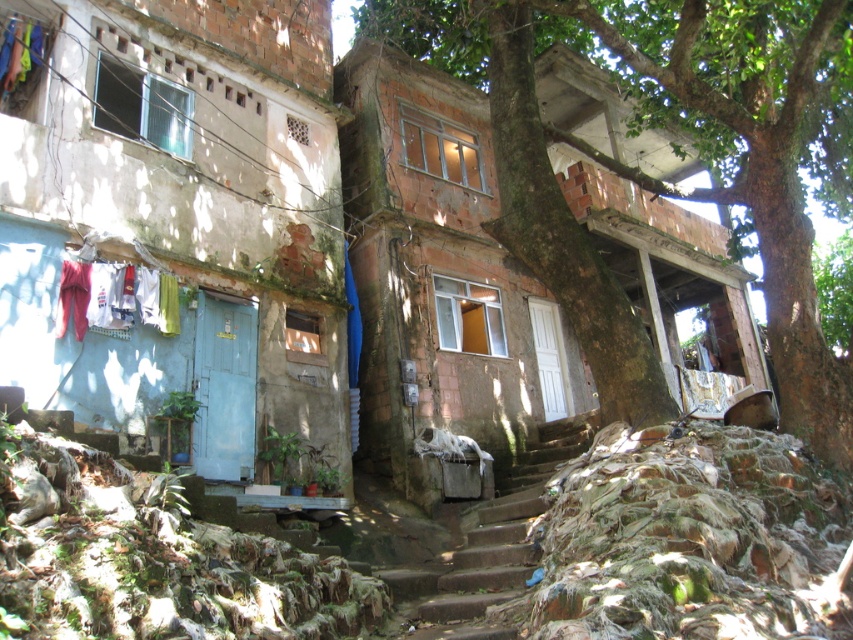
How distant is rusty concrete stairs at center from multicolored fabric at upper left?

rusty concrete stairs at center and multicolored fabric at upper left are 8.93 meters apart.

This screenshot has width=853, height=640. I want to click on rusty concrete stairs at center, so click(486, 548).

Between brown rough bark tree at center and rusty concrete stairs at center, which one is positioned higher?

brown rough bark tree at center

Can you confirm if brown rough bark tree at center is wider than rusty concrete stairs at center?

Indeed, brown rough bark tree at center has a greater width compared to rusty concrete stairs at center.

Is point (419, 42) farther from camera compared to point (509, 560)?

That is True.

At what (x,y) coordinates should I click in order to perform the action: click on brown rough bark tree at center. Please return your answer as a coordinate pair (x, y). This screenshot has height=640, width=853. Looking at the image, I should click on (682, 131).

Can you confirm if rusty concrete stairs at center is taller than white fabric at left?

Correct, rusty concrete stairs at center is much taller as white fabric at left.

Which is above, rusty concrete stairs at center or white fabric at left?

white fabric at left

Between point (581, 419) and point (167, 316), which one is positioned behind?

Positioned behind is point (581, 419).

Where is `rusty concrete stairs at center`? This screenshot has height=640, width=853. rusty concrete stairs at center is located at coordinates point(486,548).